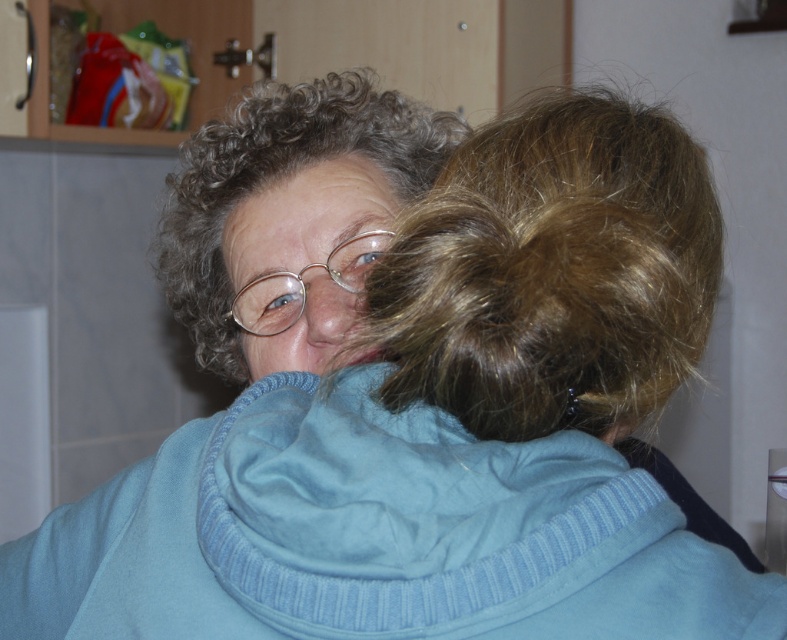
Is point (246, 518) behind point (382, 128)?

No, it is not.

Is point (545, 614) positioned in front of point (305, 83)?

That is True.

Is point (643, 608) in front of point (194, 298)?

Yes, it is in front of point (194, 298).

This screenshot has height=640, width=787. In order to click on light blue fleece at center in this screenshot , I will do `click(374, 536)`.

What are the coordinates of `brown curly hair at upper center` in the screenshot? It's located at (552, 273).

Is brown curly hair at upper center wider than curly brown hair at center?

Incorrect, brown curly hair at upper center's width does not surpass curly brown hair at center's.

I want to click on brown curly hair at upper center, so click(x=552, y=273).

Can you confirm if light blue fleece at center is positioned below brown curly hair at upper center?

Yes, light blue fleece at center is below brown curly hair at upper center.

Who is taller, light blue fleece at center or brown curly hair at upper center?

With more height is brown curly hair at upper center.

Between point (117, 548) and point (497, 336), which one is positioned in front?

Positioned in front is point (497, 336).

Find the location of `light blue fleece at center`. light blue fleece at center is located at coordinates (374, 536).